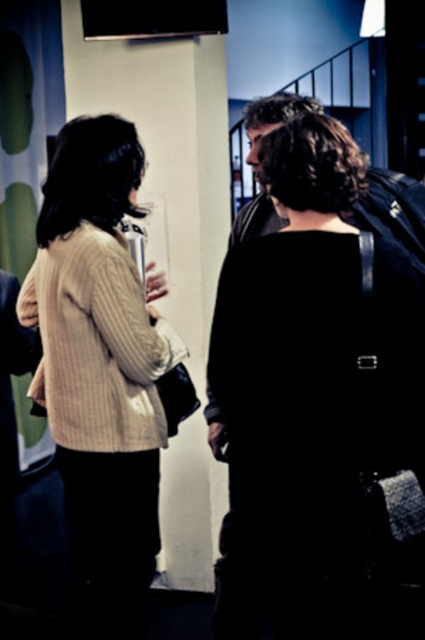
Question: Among these points, which one is farthest from the camera?

Choices:
 (A) (96, 451)
 (B) (2, 349)

Answer: (B)

Question: Which point is closer to the camera?

Choices:
 (A) beige ribbed sweater at center
 (B) knitted beige sweater at center
 (C) black matte backpack at center
 (D) knitted beige sweater at left

Answer: (C)

Question: Can you confirm if black matte backpack at center is positioned to the left of knitted beige sweater at left?

Choices:
 (A) yes
 (B) no

Answer: (B)

Question: Which of the following is the closest to the observer?

Choices:
 (A) beige ribbed sweater at center
 (B) knitted beige sweater at center
 (C) knitted beige sweater at left
 (D) black matte backpack at center

Answer: (D)

Question: Is black matte backpack at center positioned at the back of knitted beige sweater at left?

Choices:
 (A) no
 (B) yes

Answer: (A)

Question: Can you confirm if black matte backpack at center is thinner than beige ribbed sweater at center?

Choices:
 (A) yes
 (B) no

Answer: (A)